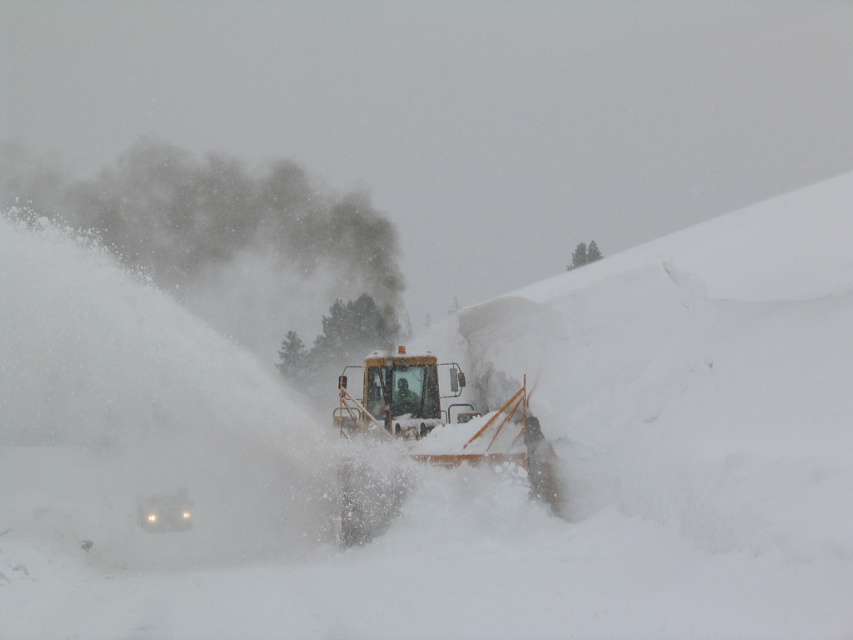
Is white powdery snow at center shorter than yellow metallic snowplow at center?

No, white powdery snow at center is not shorter than yellow metallic snowplow at center.

The height and width of the screenshot is (640, 853). I want to click on white powdery snow at center, so click(457, 472).

What are the coordinates of `white powdery snow at center` in the screenshot? It's located at (x=457, y=472).